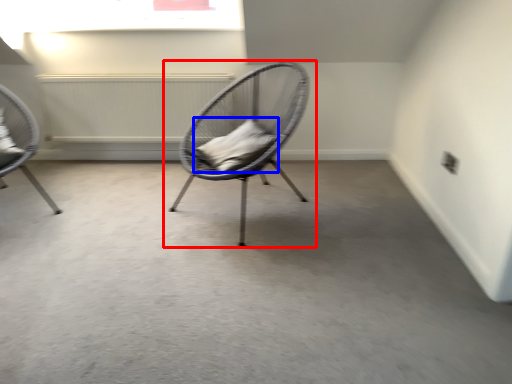
Question: Among these objects, which one is nearest to the camera, chair (highlighted by a red box) or pillow (highlighted by a blue box)?

Choices:
 (A) chair
 (B) pillow

Answer: (A)